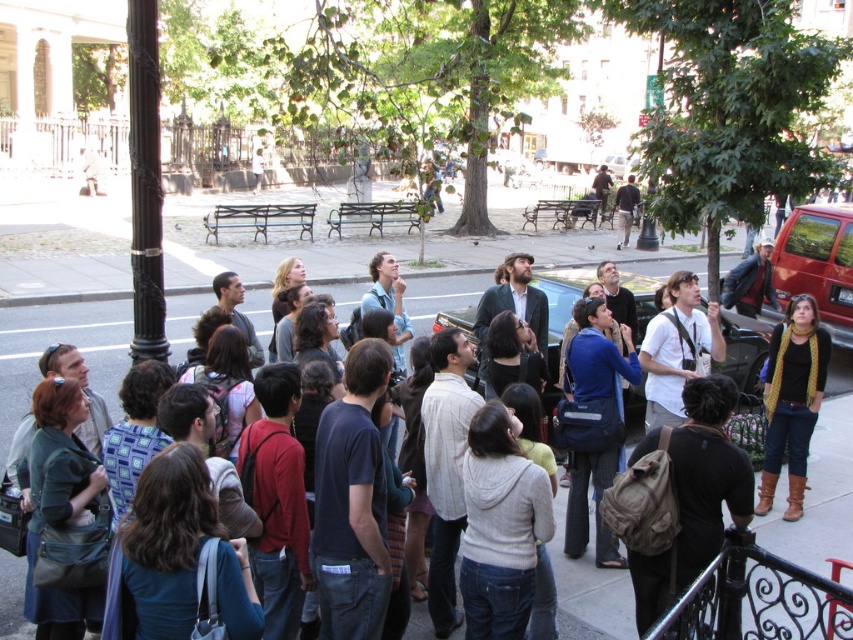
Can you confirm if gray concrete pavement at center is positioned above knitted yellow scarf at center?

Indeed, gray concrete pavement at center is positioned over knitted yellow scarf at center.

Looking at this image, who is more forward, (598, 616) or (799, 445)?

Point (598, 616) is more forward.

This screenshot has width=853, height=640. Identify the location of gray concrete pavement at center. (57, 339).